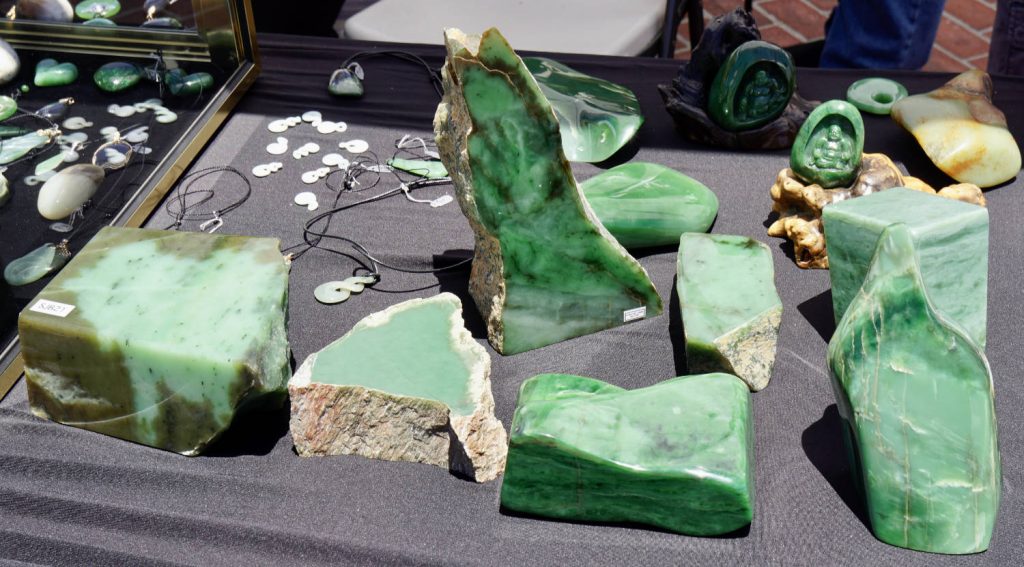
At what (x,y) coordinates should I click in order to perform the action: click on gray table. Please return your answer as a coordinate pair (x, y). Image resolution: width=1024 pixels, height=567 pixels. Looking at the image, I should click on (330, 505).